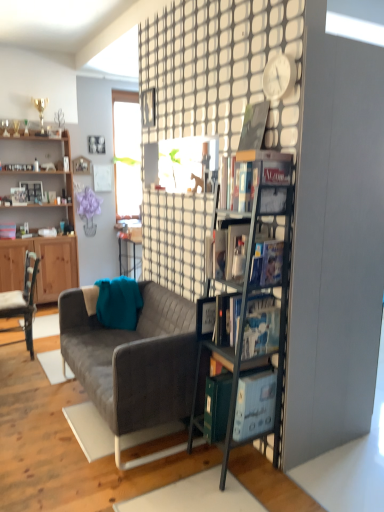
Question: Can you confirm if hardcover book at center, which is counted as the 1th book, starting from the bottom, is positioned to the left of purple fabric plant at upper center?

Choices:
 (A) yes
 (B) no

Answer: (B)

Question: Considering the relative positions of hardcover book at center, the 4th book viewed from the top, and purple fabric plant at upper center in the image provided, is hardcover book at center, the 4th book viewed from the top, to the right of purple fabric plant at upper center from the viewer's perspective?

Choices:
 (A) yes
 (B) no

Answer: (A)

Question: From a real-world perspective, is hardcover book at center, the 4th book viewed from the top, below purple fabric plant at upper center?

Choices:
 (A) yes
 (B) no

Answer: (A)

Question: Is hardcover book at center, which is counted as the 1th book, starting from the bottom, next to purple fabric plant at upper center?

Choices:
 (A) yes
 (B) no

Answer: (B)

Question: From the image's perspective, is hardcover book at center, the 4th book viewed from the top, under purple fabric plant at upper center?

Choices:
 (A) no
 (B) yes

Answer: (B)

Question: Is point (266, 192) positioned closer to the camera than point (86, 164)?

Choices:
 (A) closer
 (B) farther

Answer: (A)

Question: Is metallic gray bookshelf at center-right, arranged as the 1th shelf when viewed from the right, bigger or smaller than wooden picture frame at upper left, the second picture frame from the top?

Choices:
 (A) small
 (B) big

Answer: (B)

Question: In the image, is metallic gray bookshelf at center-right, positioned as the 2th shelf in back-to-front order, on the left side or the right side of wooden picture frame at upper left, marked as the second picture frame in a bottom-to-top arrangement?

Choices:
 (A) left
 (B) right

Answer: (B)

Question: From their relative heights in the image, would you say metallic gray bookshelf at center-right, arranged as the 1th shelf when viewed from the front, is taller or shorter than wooden picture frame at upper left, the second picture frame from the top?

Choices:
 (A) short
 (B) tall

Answer: (B)

Question: From the image's perspective, relative to white plastic clock at upper center, is wooden cabinet at left, the 2th shelf from the front, above or below?

Choices:
 (A) above
 (B) below

Answer: (B)

Question: Is wooden cabinet at left, the first shelf from the back, to the left or to the right of white plastic clock at upper center in the image?

Choices:
 (A) left
 (B) right

Answer: (A)

Question: Is point (3, 248) positioned closer to the camera than point (284, 74)?

Choices:
 (A) farther
 (B) closer

Answer: (A)

Question: Considering the positions of wooden cabinet at left, which is the first shelf in left-to-right order, and white plastic clock at upper center in the image, is wooden cabinet at left, which is the first shelf in left-to-right order, wider or thinner than white plastic clock at upper center?

Choices:
 (A) wide
 (B) thin

Answer: (A)

Question: Is matte black picture frame at upper center, which appears as the third picture frame when ordered from the bottom, inside the boundaries of textured gray couch at center, or outside?

Choices:
 (A) inside
 (B) outside

Answer: (B)

Question: Is point (92, 138) closer or farther from the camera than point (59, 314)?

Choices:
 (A) farther
 (B) closer

Answer: (A)